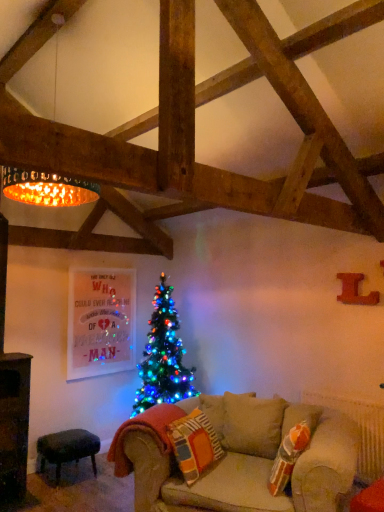
Question: Is velvet dark green stool at lower left positioned with its back to knitted fabric pillow at lower center?

Choices:
 (A) no
 (B) yes

Answer: (A)

Question: Is velvet dark green stool at lower left further to camera compared to knitted fabric pillow at lower center?

Choices:
 (A) yes
 (B) no

Answer: (A)

Question: Can you confirm if velvet dark green stool at lower left is thinner than knitted fabric pillow at lower center?

Choices:
 (A) yes
 (B) no

Answer: (B)

Question: Considering the relative sizes of velvet dark green stool at lower left and knitted fabric pillow at lower center in the image provided, is velvet dark green stool at lower left bigger than knitted fabric pillow at lower center?

Choices:
 (A) no
 (B) yes

Answer: (B)

Question: Would you consider velvet dark green stool at lower left to be distant from knitted fabric pillow at lower center?

Choices:
 (A) yes
 (B) no

Answer: (A)

Question: Does velvet dark green stool at lower left have a smaller size compared to knitted fabric pillow at lower center?

Choices:
 (A) no
 (B) yes

Answer: (A)

Question: Considering the relative sizes of golden metallic lampshade at upper left and knitted fabric pillow at lower center in the image provided, is golden metallic lampshade at upper left bigger than knitted fabric pillow at lower center?

Choices:
 (A) yes
 (B) no

Answer: (A)

Question: Is golden metallic lampshade at upper left with knitted fabric pillow at lower center?

Choices:
 (A) yes
 (B) no

Answer: (B)

Question: From the image's perspective, is golden metallic lampshade at upper left located beneath knitted fabric pillow at lower center?

Choices:
 (A) no
 (B) yes

Answer: (A)

Question: From the image's perspective, would you say golden metallic lampshade at upper left is positioned over knitted fabric pillow at lower center?

Choices:
 (A) no
 (B) yes

Answer: (B)

Question: Considering the relative sizes of golden metallic lampshade at upper left and knitted fabric pillow at lower center in the image provided, is golden metallic lampshade at upper left smaller than knitted fabric pillow at lower center?

Choices:
 (A) no
 (B) yes

Answer: (A)

Question: Is golden metallic lampshade at upper left to the right of knitted fabric pillow at lower center from the viewer's perspective?

Choices:
 (A) no
 (B) yes

Answer: (A)

Question: From the image's perspective, does golden metallic lampshade at upper left appear lower than velvet dark green stool at lower left?

Choices:
 (A) no
 (B) yes

Answer: (A)